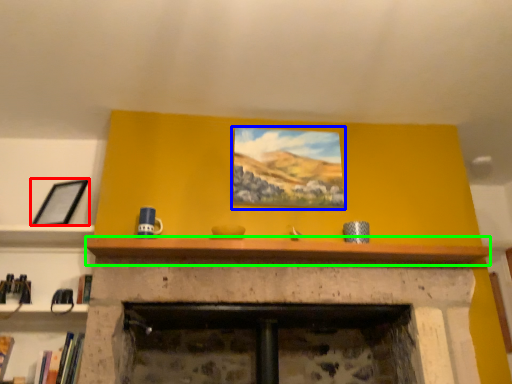
Question: Which object is the closest to the picture frame (highlighted by a red box)? Choose among these: picture frame (highlighted by a blue box) or mantle (highlighted by a green box).

Choices:
 (A) picture frame
 (B) mantle

Answer: (B)